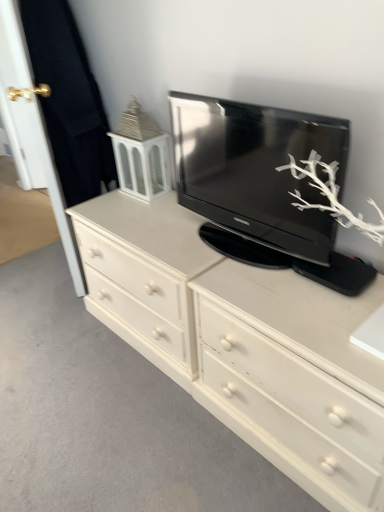
I want to click on free spot in front of gold metallic door handle at upper left, which is counted as the second door, starting from the right, so (x=34, y=212).